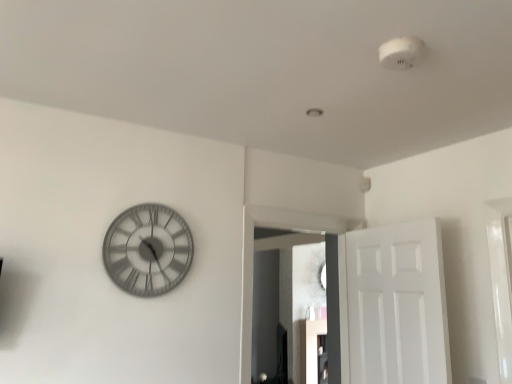
Question: Does matte glass mirror at center lie behind white matte door at right?

Choices:
 (A) no
 (B) yes

Answer: (B)

Question: Does matte glass mirror at center lie in front of white matte door at right?

Choices:
 (A) no
 (B) yes

Answer: (A)

Question: Is matte glass mirror at center at the right side of white matte door at right?

Choices:
 (A) yes
 (B) no

Answer: (B)

Question: Would you say matte glass mirror at center is a long distance from white matte door at right?

Choices:
 (A) yes
 (B) no

Answer: (A)

Question: Is matte glass mirror at center with white matte door at right?

Choices:
 (A) yes
 (B) no

Answer: (B)

Question: From the image's perspective, is white matte door at right positioned above or below metallic gray clock at left?

Choices:
 (A) above
 (B) below

Answer: (B)

Question: From a real-world perspective, is white matte door at right positioned above or below metallic gray clock at left?

Choices:
 (A) above
 (B) below

Answer: (B)

Question: Relative to metallic gray clock at left, is white matte door at right in front or behind?

Choices:
 (A) behind
 (B) front

Answer: (A)

Question: Does point (389, 289) appear closer or farther from the camera than point (153, 231)?

Choices:
 (A) farther
 (B) closer

Answer: (A)

Question: Is metallic gray clock at left to the left or to the right of white matte door at right in the image?

Choices:
 (A) right
 (B) left

Answer: (B)

Question: In terms of size, does metallic gray clock at left appear bigger or smaller than white matte door at right?

Choices:
 (A) big
 (B) small

Answer: (B)

Question: Is point (161, 208) positioned closer to the camera than point (413, 273)?

Choices:
 (A) farther
 (B) closer

Answer: (B)

Question: Which is correct: metallic gray clock at left is inside white matte door at right, or outside of it?

Choices:
 (A) outside
 (B) inside

Answer: (A)

Question: From a real-world perspective, is metallic gray clock at left above or below matte glass mirror at center?

Choices:
 (A) above
 (B) below

Answer: (A)

Question: From the image's perspective, relative to matte glass mirror at center, is metallic gray clock at left above or below?

Choices:
 (A) below
 (B) above

Answer: (B)